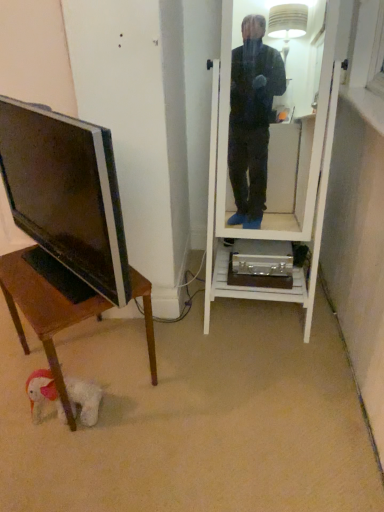
Question: From their relative heights in the image, would you say wooden desk at lower left is taller or shorter than white glossy mirror at center?

Choices:
 (A) tall
 (B) short

Answer: (B)

Question: Is wooden desk at lower left to the left or to the right of white glossy mirror at center in the image?

Choices:
 (A) left
 (B) right

Answer: (A)

Question: Which is farther from the wooden desk at lower left?

Choices:
 (A) matte black tv at left
 (B) white glossy mirror at center

Answer: (B)

Question: Which of these objects is positioned farthest from the white glossy mirror at center?

Choices:
 (A) matte black tv at left
 (B) wooden desk at lower left

Answer: (A)